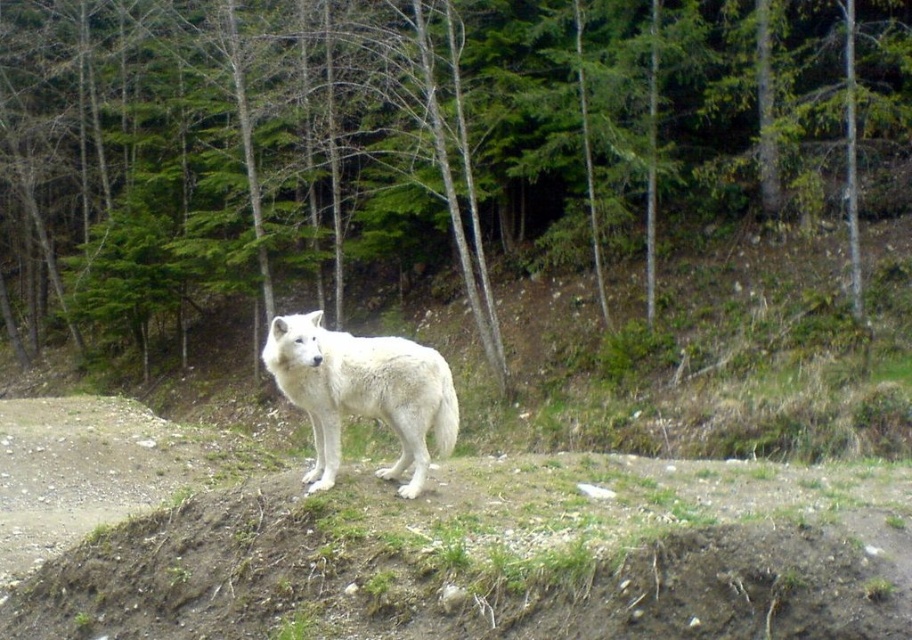
You are a photographer trying to capture the white fur wolf at center and the green leafy tree at center in a single frame. Based on their sizes, which object should you focus on first to ensure both fit in the shot?

The green leafy tree at center is wider than the white fur wolf at center, so you should focus on framing the green leafy tree at center first to ensure both fit in the shot.

Consider the image. You are a hiker lost in the forest and see the white wolf on the grassy mound. You notice a point marked at coordinates (410, 141). What object is located at that point?

The point at coordinates (410, 141) marks the green leafy tree at center.